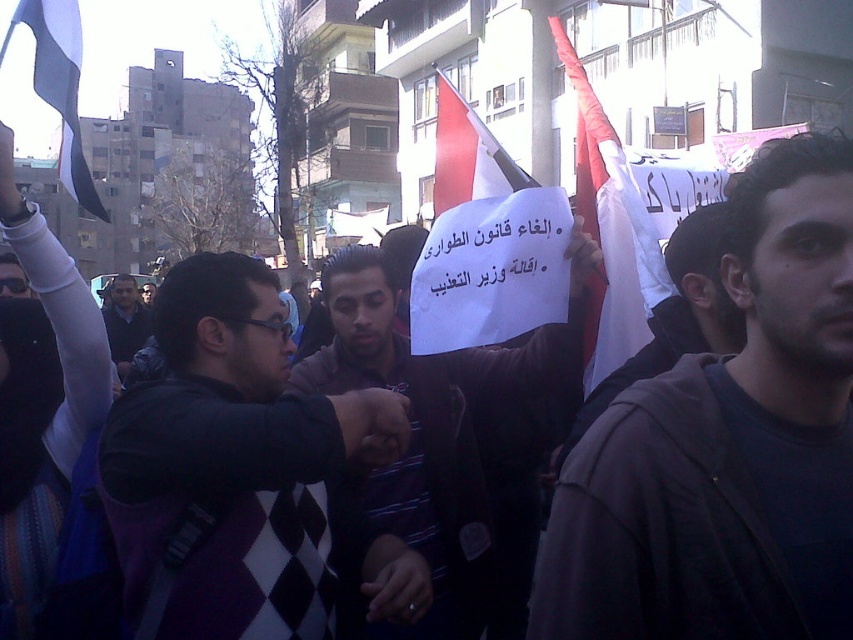
You are standing in the protest scene and want to know which of the two points, point (656, 616) or point (392, 428), is closer to you. Can you determine this based on their positions?

Point (656, 616) is closer to the viewer than point (392, 428).